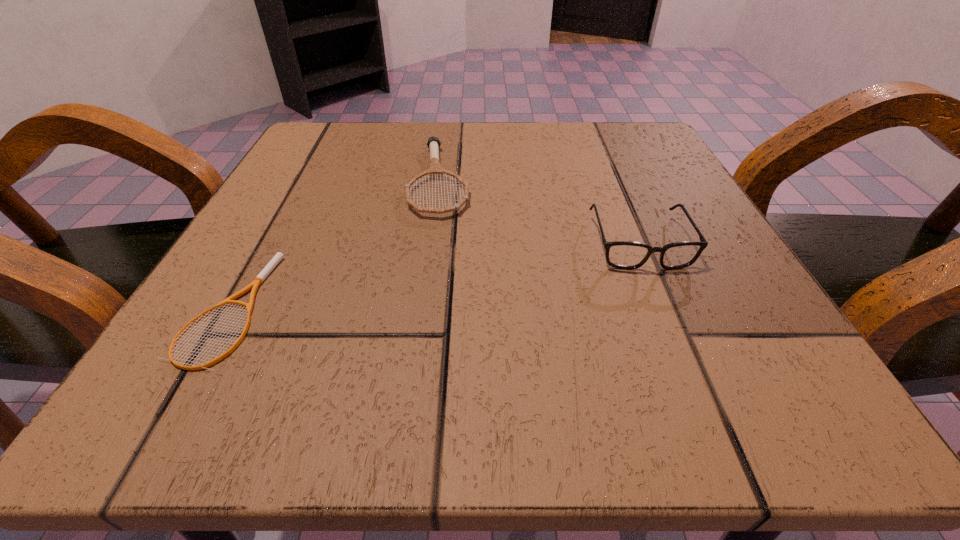
This screenshot has width=960, height=540. I want to click on spectacles, so click(x=628, y=255).

What are the coordinates of `the rightmost object` in the screenshot? It's located at (628, 255).

This screenshot has height=540, width=960. In order to click on the taller tennis racket in this screenshot , I will do pyautogui.click(x=435, y=169).

What are the coordinates of `the right tennis racket` in the screenshot? It's located at [x=435, y=169].

At what (x,y) coordinates should I click in order to perform the action: click on the shorter tennis racket. Please return your answer as a coordinate pair (x, y). Image resolution: width=960 pixels, height=540 pixels. Looking at the image, I should click on (258, 280).

You are a GUI agent. You are given a task and a screenshot of the screen. Output one action in this format:
    pyautogui.click(x=<x>, y=<y>)
    Task: Click on the leftmost object
    
    Given the screenshot: What is the action you would take?
    pyautogui.click(x=258, y=280)

Locate an element on the screen. This screenshot has width=960, height=540. vacant space situated on the front-facing side of the rightmost object is located at coordinates (679, 340).

Find the location of `vacant area situated on the front of the taller tennis racket`. vacant area situated on the front of the taller tennis racket is located at coordinates (415, 373).

At what (x,y) coordinates should I click in order to perform the action: click on free location located 0.130m on the back of the nearer tennis racket. Please return your answer as a coordinate pair (x, y). This screenshot has width=960, height=540. Looking at the image, I should click on (285, 207).

The width and height of the screenshot is (960, 540). Identify the location of object at the far edge. (435, 169).